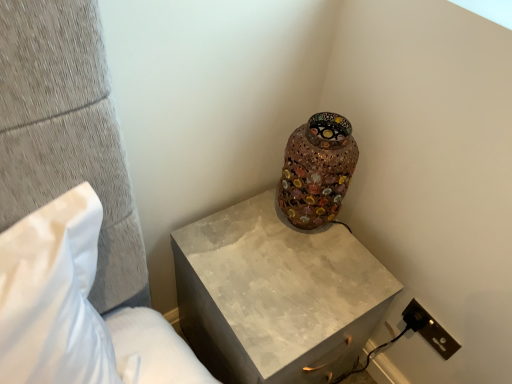
Image resolution: width=512 pixels, height=384 pixels. In order to click on vacant area on top of matte concrete nightstand at upper right (from a real-world perspective) in this screenshot , I will do `click(276, 260)`.